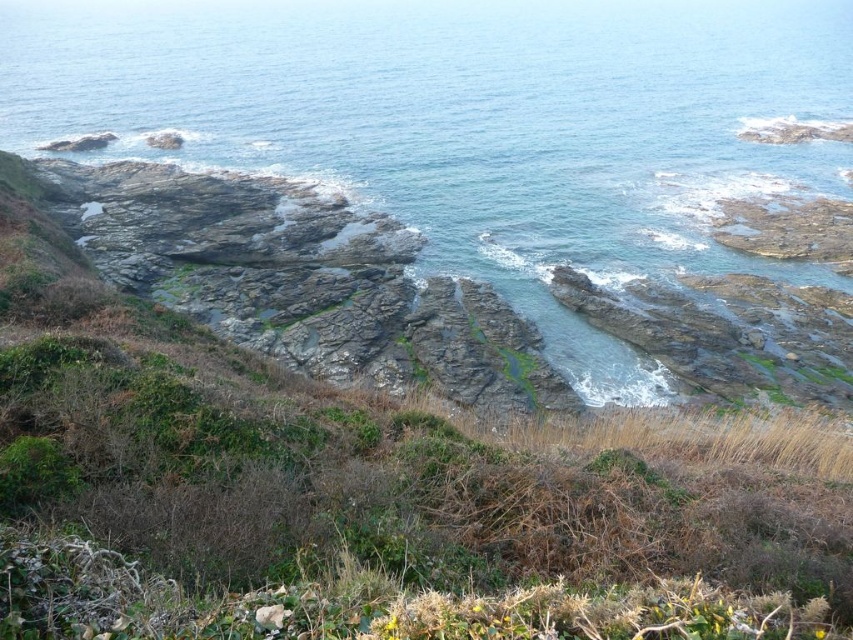
Question: Among these objects, which one is nearest to the camera?

Choices:
 (A) clear blue water at center
 (B) rusty stone cliff at center

Answer: (B)

Question: Can you confirm if clear blue water at center is positioned to the left of rusty stone cliff at center?

Choices:
 (A) yes
 (B) no

Answer: (B)

Question: Is clear blue water at center thinner than rusty stone cliff at center?

Choices:
 (A) yes
 (B) no

Answer: (B)

Question: Is the position of clear blue water at center more distant than that of rusty stone cliff at center?

Choices:
 (A) yes
 (B) no

Answer: (A)

Question: Which of the following is the farthest from the observer?

Choices:
 (A) clear blue water at center
 (B) rusty stone cliff at center

Answer: (A)

Question: Among these objects, which one is farthest from the camera?

Choices:
 (A) clear blue water at center
 (B) rusty stone cliff at center

Answer: (A)